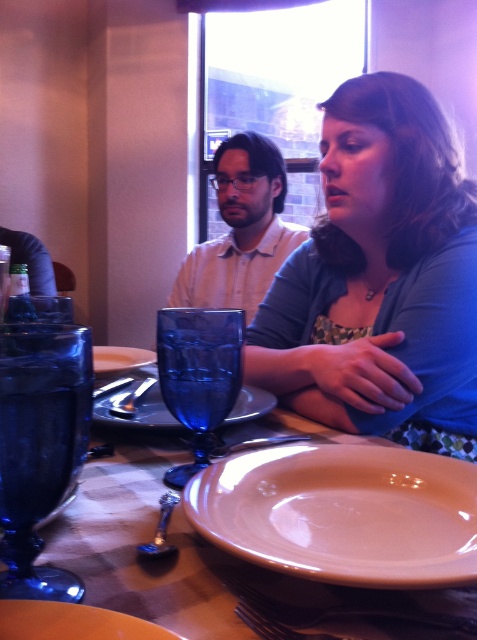
Question: Can you confirm if blue glass at center is bigger than brushed metal knife at upper left?

Choices:
 (A) yes
 (B) no

Answer: (A)

Question: Which object appears farthest from the camera in this image?

Choices:
 (A) blue glass at left
 (B) blue glass at center
 (C) matte ceramic plate at center

Answer: (B)

Question: Is matte ceramic plate at center bigger than blue glass plate at center?

Choices:
 (A) no
 (B) yes

Answer: (A)

Question: Does blue fabric shirt at upper right appear on the right side of blue glass plate at center?

Choices:
 (A) yes
 (B) no

Answer: (A)

Question: Which is nearer to the matte ceramic plate at center?

Choices:
 (A) satin silver spoon at center
 (B) matte white plate at center

Answer: (A)

Question: Which of these objects is positioned closest to the matte orange plate at lower center?

Choices:
 (A) blue fabric shirt at upper right
 (B) satin silver spoon at center
 (C) matte white shirt at center
 (D) brushed metal knife at upper left

Answer: (B)